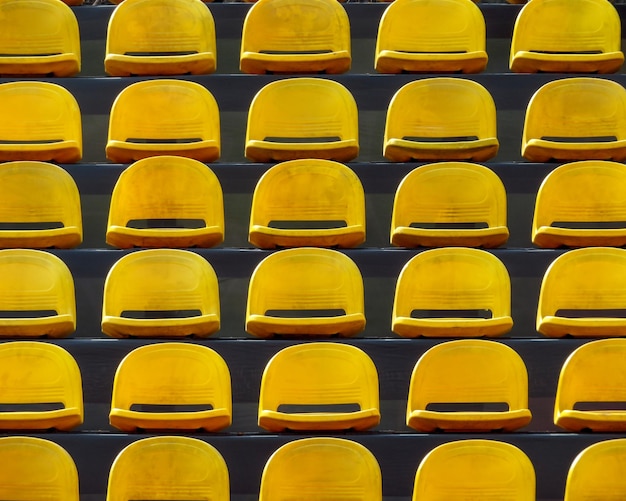
Where is `seats located 4th row from the top`? The image size is (626, 501). seats located 4th row from the top is located at coordinates (38, 275), (154, 287), (289, 281), (454, 268), (597, 281).